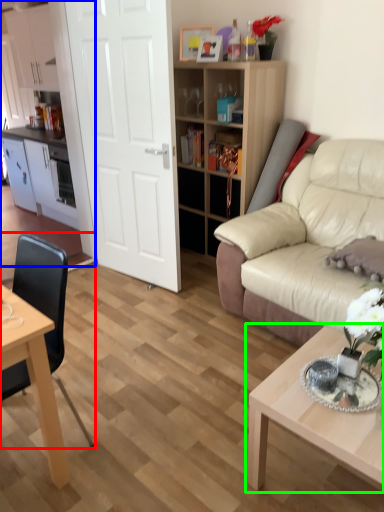
Question: Which object is the closest to the chair (highlighted by a red box)? Choose among these: entertainment center (highlighted by a blue box) or coffee table (highlighted by a green box).

Choices:
 (A) entertainment center
 (B) coffee table

Answer: (B)